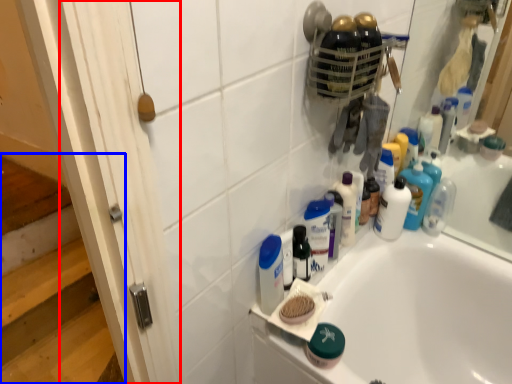
Question: Which object is closer to the camera taking this photo, screen door (highlighted by a red box) or stairwell (highlighted by a blue box)?

Choices:
 (A) screen door
 (B) stairwell

Answer: (A)